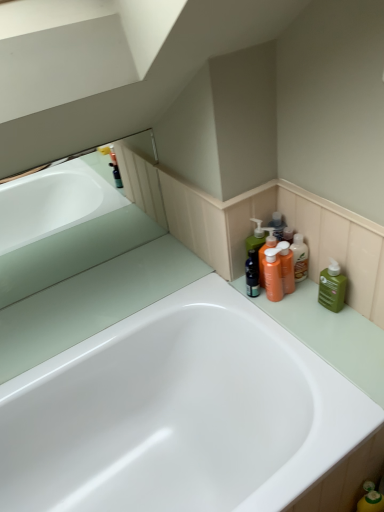
The height and width of the screenshot is (512, 384). I want to click on vacant region to the left of green matte bottle at right, marked as the second cleaning product in a left-to-right arrangement, so [289, 315].